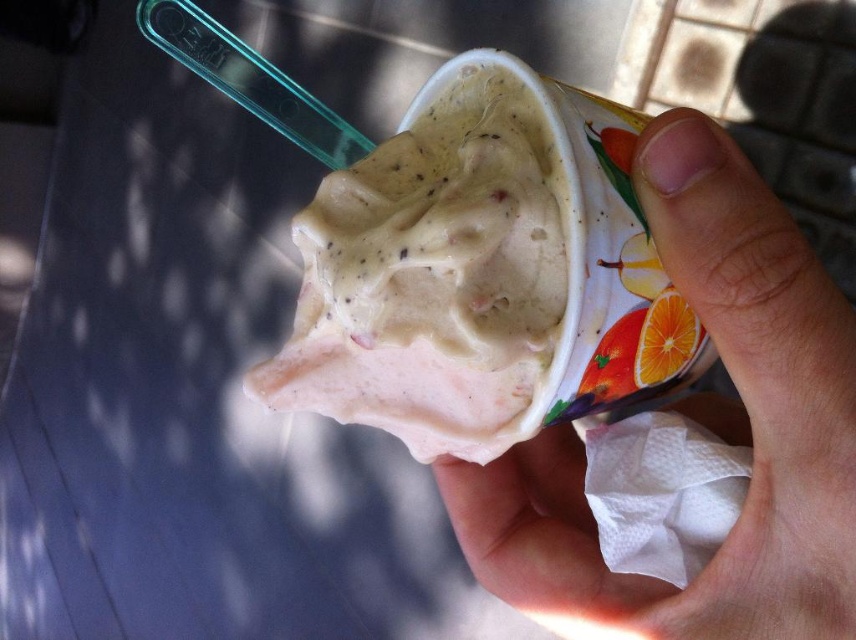
You are a photographer taking a close up shot of a hand holding an ice cream cup. The camera is positioned at the viewer position. The smooth skin hand at center is holding the cup. To ensure the hand is in focus, the camera needs to be at least 16.5 inches away. Is the current distance sufficient?

The smooth skin hand at center and viewer are 16.49 inches apart, which is just below the required 16.5 inches. Therefore, the current distance is insufficient to ensure the hand is in focus.

You are trying to place a cherry exactly where the whipped cream at center is currently located. According to the coordinates provided, where should you place the cherry?

The whipped cream at center is located at point coordinates (x=474, y=269), so you should place the cherry at those coordinates.

You are at a cafe and want to place a small napkin between the whipped cream at center and the orange matte at upper right on your dessert. The napkin is 2 inches wide. Can you fit it without overlapping either?

The whipped cream at center is 5.02 inches from orange matte at upper right. Since the napkin is 2 inches wide, there is enough space to place it between them without overlapping either.